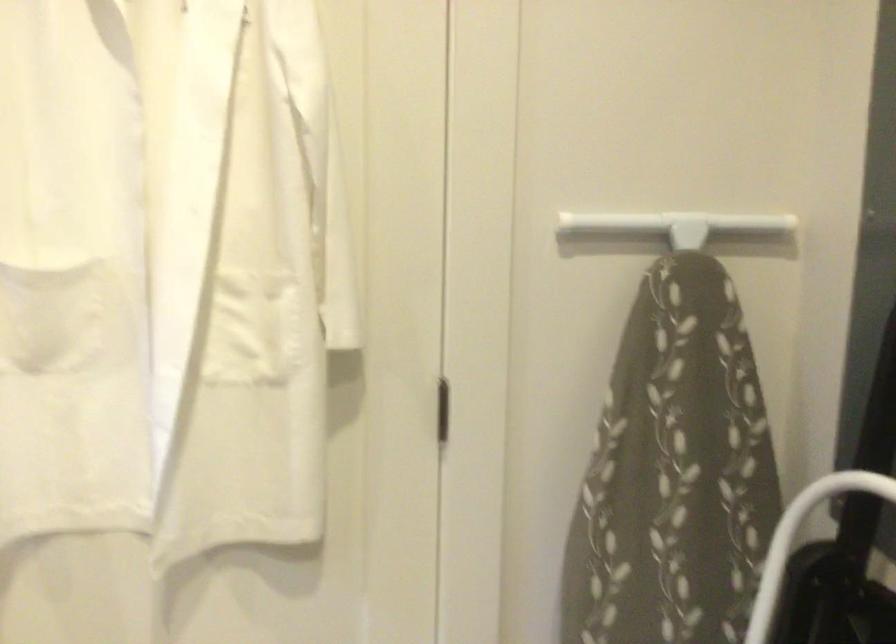
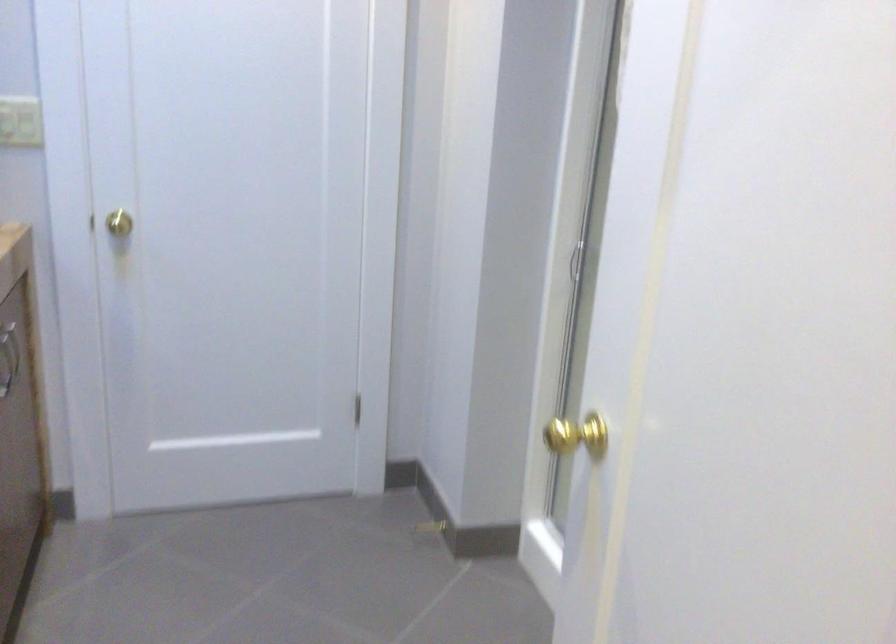
How did the camera likely rotate?

The camera's rotation is toward right-down.